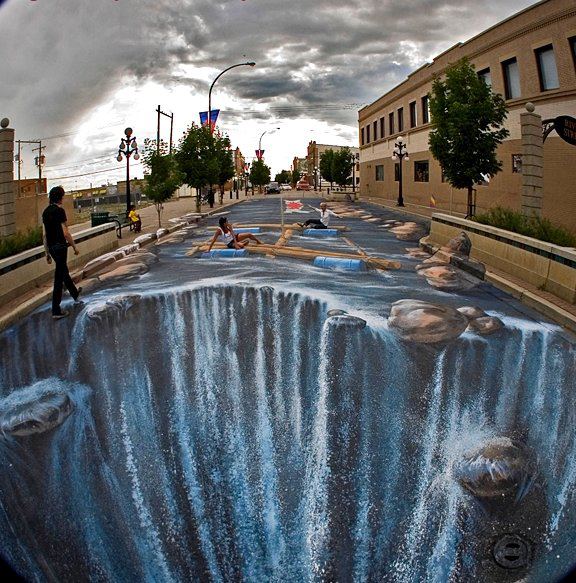
Image resolution: width=576 pixels, height=583 pixels. Identify the location of gray windows. (548, 66), (511, 82).